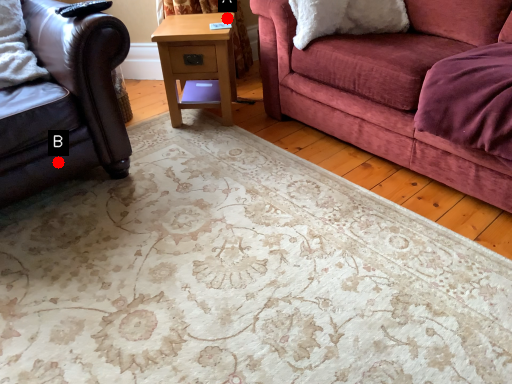
Question: Two points are circled on the image, labeled by A and B beside each circle. Which of the following is the farthest from the observer?

Choices:
 (A) A is further
 (B) B is further

Answer: (A)